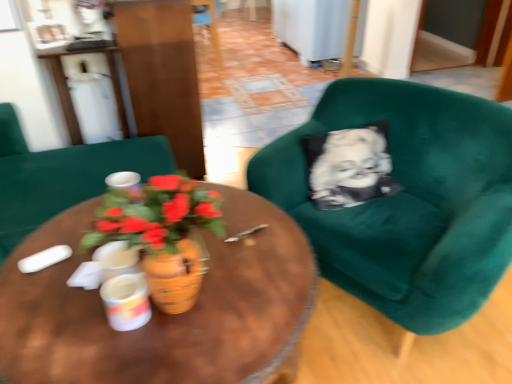
Where is `vacant area in front of terracotta pot at center`? The height and width of the screenshot is (384, 512). vacant area in front of terracotta pot at center is located at coordinates (161, 364).